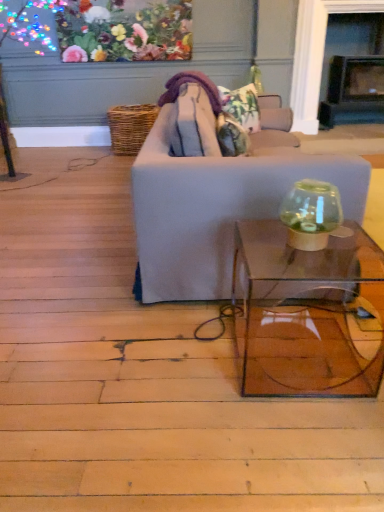
Question: Is transparent glass fishbowl at right at the right side of light gray fabric couch at center?

Choices:
 (A) yes
 (B) no

Answer: (A)

Question: Does transparent glass fishbowl at right have a greater height compared to light gray fabric couch at center?

Choices:
 (A) yes
 (B) no

Answer: (B)

Question: Is light gray fabric couch at center located within transparent glass fishbowl at right?

Choices:
 (A) no
 (B) yes

Answer: (A)

Question: Is transparent glass fishbowl at right thinner than light gray fabric couch at center?

Choices:
 (A) yes
 (B) no

Answer: (A)

Question: Is transparent glass fishbowl at right outside light gray fabric couch at center?

Choices:
 (A) no
 (B) yes

Answer: (B)

Question: From their relative heights in the image, would you say floral fabric pillow at center is taller or shorter than light gray fabric couch at center?

Choices:
 (A) tall
 (B) short

Answer: (B)

Question: In the image, is floral fabric pillow at center positioned in front of or behind light gray fabric couch at center?

Choices:
 (A) behind
 (B) front

Answer: (A)

Question: Based on their positions, is floral fabric pillow at center located to the left or right of light gray fabric couch at center?

Choices:
 (A) right
 (B) left

Answer: (A)

Question: From a real-world perspective, is floral fabric pillow at center above or below light gray fabric couch at center?

Choices:
 (A) below
 (B) above

Answer: (B)

Question: In the image, is floral fabric pillow at center positioned in front of or behind transparent glass table at center?

Choices:
 (A) front
 (B) behind

Answer: (B)

Question: In terms of width, does floral fabric pillow at center look wider or thinner when compared to transparent glass table at center?

Choices:
 (A) thin
 (B) wide

Answer: (A)

Question: From a real-world perspective, is floral fabric pillow at center above or below transparent glass table at center?

Choices:
 (A) above
 (B) below

Answer: (A)

Question: Would you say floral fabric pillow at center is inside or outside transparent glass table at center?

Choices:
 (A) outside
 (B) inside

Answer: (A)

Question: From the image's perspective, is transparent glass table at center positioned above or below floral fabric pillow at center?

Choices:
 (A) below
 (B) above

Answer: (A)

Question: Looking at the image, does transparent glass table at center seem bigger or smaller compared to floral fabric pillow at center?

Choices:
 (A) big
 (B) small

Answer: (A)